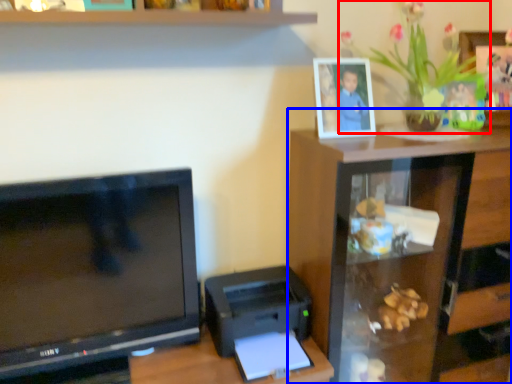
Question: Which of the following is the closest to the observer, houseplant (highlighted by a red box) or furniture (highlighted by a blue box)?

Choices:
 (A) houseplant
 (B) furniture

Answer: (A)